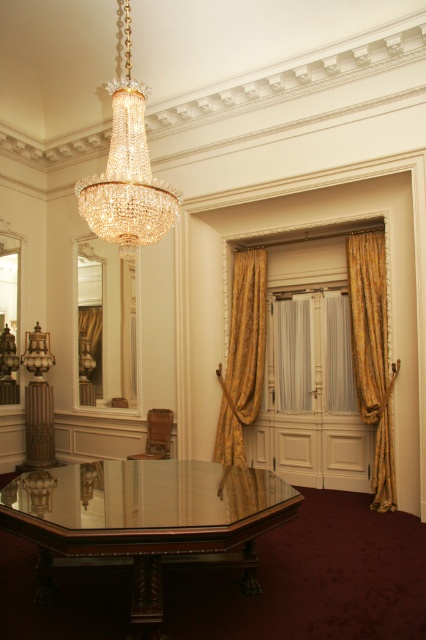
What are the coordinates of `polished glass table at center` in the screenshot? It's located at (144, 520).

Can you confirm if polished glass table at center is shorter than wooden chair at center?

No.

Where is `polished glass table at center`? The image size is (426, 640). polished glass table at center is located at coordinates (144, 520).

Find the location of a particular element. polished glass table at center is located at coordinates (144, 520).

Between polished glass table at center and gold textured curtain at right, which one appears on the right side from the viewer's perspective?

gold textured curtain at right

Identify the location of polished glass table at center. Image resolution: width=426 pixels, height=640 pixels. (144, 520).

Who is more forward, (x=201, y=504) or (x=382, y=353)?

Positioned in front is point (x=201, y=504).

This screenshot has width=426, height=640. I want to click on polished glass table at center, so click(144, 520).

Between crystal glass chandelier at upper center and gold textured curtain at center, which one has more height?

gold textured curtain at center is taller.

Which is in front, point (104, 193) or point (247, 262)?

Point (104, 193)

Which is behind, point (175, 208) or point (252, 356)?

Positioned behind is point (252, 356).

Find the location of a particular element. The height and width of the screenshot is (640, 426). crystal glass chandelier at upper center is located at coordinates (127, 173).